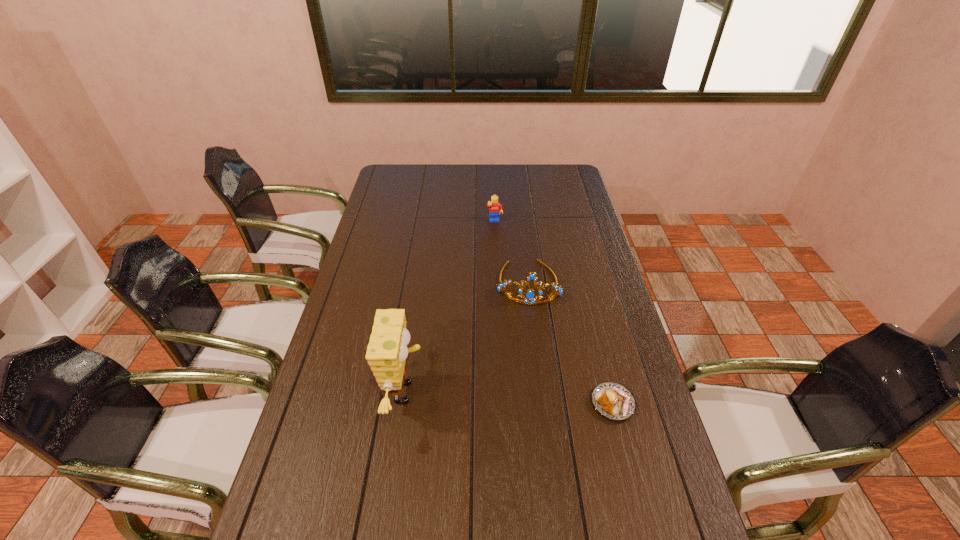
This screenshot has width=960, height=540. In order to click on free space on the desktop that is between the sponge and the rightmost object and is positioned on the face of the farthest object in this screenshot , I will do `click(521, 399)`.

This screenshot has width=960, height=540. Find the location of `free space on the desktop that is between the sponge and the rightmost object and is positioned on the front-facing side of the second farthest object`. free space on the desktop that is between the sponge and the rightmost object and is positioned on the front-facing side of the second farthest object is located at coordinates (527, 399).